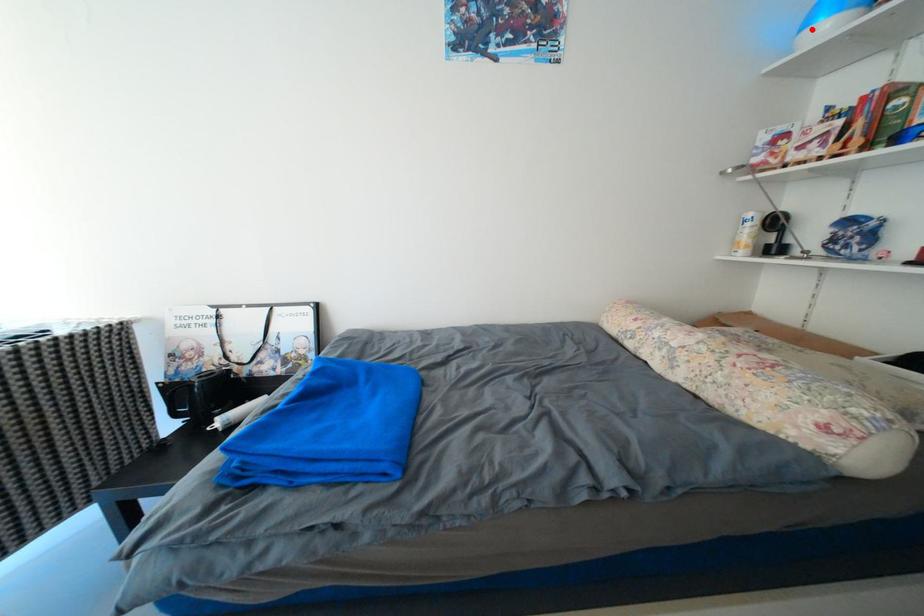
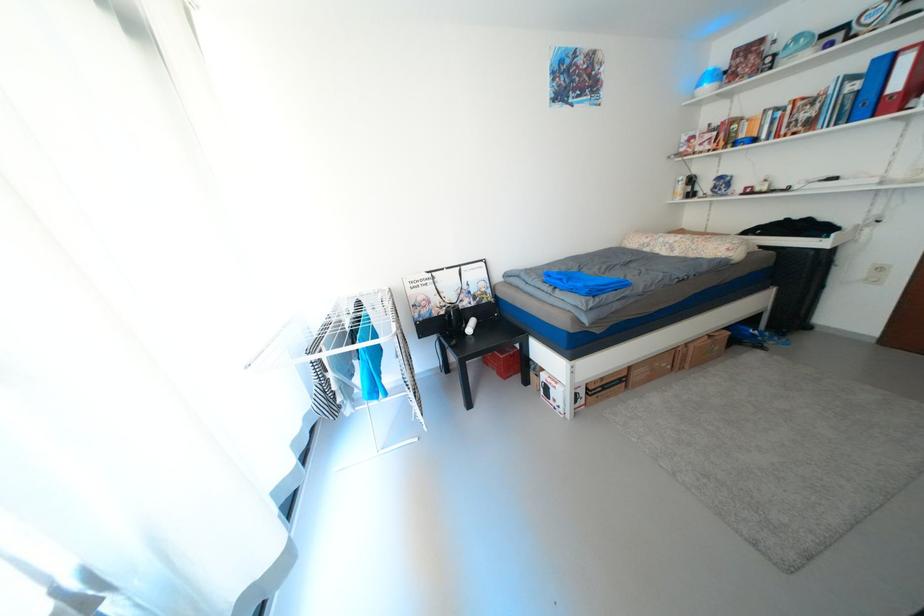
Locate, in the second image, the point that corresponds to the highlighted location in the first image.

(707, 87)